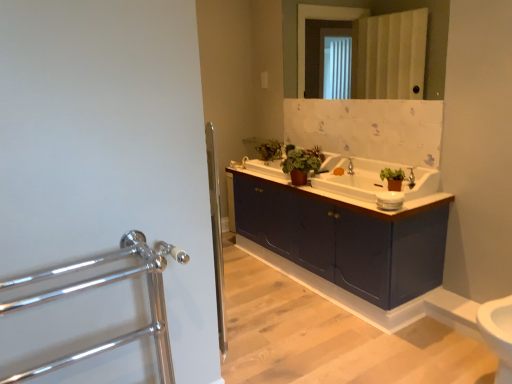
The image size is (512, 384). What do you see at coordinates (216, 234) in the screenshot?
I see `clear glass screen door at center` at bounding box center [216, 234].

Describe the element at coordinates (270, 150) in the screenshot. I see `green matte plant at upper center, which ranks as the 1th plant in left-to-right order` at that location.

Measure the distance between point (x=349, y=164) and camera.

2.93 meters.

Image resolution: width=512 pixels, height=384 pixels. I want to click on clear glass screen door at center, so click(x=216, y=234).

From a real-world perspective, which object stands above the other?

green matte plant at upper center, the second plant viewed from the front, is physically above.

Is green matte plant at upper center, arranged as the first plant when viewed from the back, positioned far away from white glossy sink at center?

That's not correct — green matte plant at upper center, arranged as the first plant when viewed from the back, is a little close to white glossy sink at center.

Where is `sink lying below the green matte plant at upper center, arranged as the first plant when viewed from the back (from the image's perspective)`? The height and width of the screenshot is (384, 512). sink lying below the green matte plant at upper center, arranged as the first plant when viewed from the back (from the image's perspective) is located at coordinates (355, 177).

From a real-world perspective, is matte blue cabinet at center positioned under matte white mirror at upper center based on gravity?

Yes.

Locate an element on the screen. Image resolution: width=512 pixels, height=384 pixels. bathroom cabinet below the matte white mirror at upper center (from the image's perspective) is located at coordinates (347, 238).

Is matte blue cabinet at center placed right next to matte white mirror at upper center?

No.

From the image's perspective, which is above, matte blue cabinet at center or matte silver faucet at center?

matte silver faucet at center is shown above in the image.

Which of these two, matte blue cabinet at center or matte silver faucet at center, is smaller?

matte silver faucet at center is smaller.

Between matte blue cabinet at center and matte silver faucet at center, which one is positioned behind?

matte silver faucet at center is further from the camera.

Considering the relative sizes of matte blue cabinet at center and matte silver faucet at center in the image provided, is matte blue cabinet at center shorter than matte silver faucet at center?

Incorrect, the height of matte blue cabinet at center does not fall short of that of matte silver faucet at center.

Considering the sizes of matte white mirror at upper center and matte silver faucet at center in the image, is matte white mirror at upper center bigger or smaller than matte silver faucet at center?

Considering their sizes, matte white mirror at upper center takes up more space than matte silver faucet at center.

Considering the sizes of objects matte white mirror at upper center and matte silver faucet at center in the image provided, who is shorter, matte white mirror at upper center or matte silver faucet at center?

matte silver faucet at center.

Is matte white mirror at upper center to the left of matte silver faucet at center from the viewer's perspective?

Correct, you'll find matte white mirror at upper center to the left of matte silver faucet at center.

Is there a large distance between matte white mirror at upper center and matte silver faucet at center?

Indeed, matte white mirror at upper center is not near matte silver faucet at center.

Can you confirm if matte white mirror at upper center is smaller than green matte plant at center, marked as the first plant in a front-to-back arrangement?

No, matte white mirror at upper center is not smaller than green matte plant at center, marked as the first plant in a front-to-back arrangement.

Consider the image. Considering the relative sizes of matte white mirror at upper center and green matte plant at center, acting as the 2th plant starting from the left, in the image provided, is matte white mirror at upper center shorter than green matte plant at center, acting as the 2th plant starting from the left,?

In fact, matte white mirror at upper center may be taller than green matte plant at center, acting as the 2th plant starting from the left.

Looking at this image, how many degrees apart are the facing directions of matte white mirror at upper center and green matte plant at center, placed as the first plant when sorted from right to left?

The facing directions of matte white mirror at upper center and green matte plant at center, placed as the first plant when sorted from right to left, are 1.13 degrees apart.

Choose the correct answer: Is matte white mirror at upper center inside green matte plant at center, the second plant viewed from the back, or outside it?

matte white mirror at upper center is not inside green matte plant at center, the second plant viewed from the back, it's outside.

Does matte blue cabinet at center turn towards clear glass screen door at center?

Yes, matte blue cabinet at center faces towards clear glass screen door at center.

Which of these two, matte blue cabinet at center or clear glass screen door at center, is wider?

matte blue cabinet at center is wider.

From the image's perspective, is matte blue cabinet at center on clear glass screen door at center?

Indeed, from the image's perspective, matte blue cabinet at center is shown above clear glass screen door at center.

Does matte blue cabinet at center lie in front of clear glass screen door at center?

That is False.

Does white glossy sink at center have a larger size compared to polished chrome towel rack at left?

Incorrect, white glossy sink at center is not larger than polished chrome towel rack at left.

Is polished chrome towel rack at left surrounded by white glossy sink at center?

Actually, polished chrome towel rack at left is outside white glossy sink at center.

From the image's perspective, is white glossy sink at center over polished chrome towel rack at left?

Yes, from the image's perspective, white glossy sink at center is on top of polished chrome towel rack at left.

Which plant is the 2nd one when counting from the back of the white glossy sink at center? Please provide its 2D coordinates.

[(270, 150)]

The height and width of the screenshot is (384, 512). What are the coordinates of `bathroom cabinet on the left of matte white mirror at upper center` in the screenshot? It's located at (347, 238).

Which object lies further to the anchor point matte silver faucet at center, green matte plant at center, the second plant viewed from the back, or matte blue cabinet at center?

matte blue cabinet at center.

Which object lies further to the anchor point matte white mirror at upper center, white glossy sink at center or green matte plant at upper center, which ranks as the 1th plant in left-to-right order?

white glossy sink at center is further to matte white mirror at upper center.

Estimate the real-world distances between objects in this image. Which object is closer to matte white mirror at upper center, clear glass screen door at center or matte blue cabinet at center?

matte blue cabinet at center is closer to matte white mirror at upper center.

Which object lies further to the anchor point matte blue cabinet at center, white glossy sink at center or matte silver faucet at center?

Among the two, matte silver faucet at center is located further to matte blue cabinet at center.

Estimate the real-world distances between objects in this image. Which object is closer to green matte plant at upper center, which ranks as the 1th plant in left-to-right order, polished chrome towel rack at left or green matte plant at center, acting as the 2th plant starting from the left?

The object closer to green matte plant at upper center, which ranks as the 1th plant in left-to-right order, is green matte plant at center, acting as the 2th plant starting from the left.

Based on their spatial positions, is green matte plant at upper center, the second plant viewed from the front, or matte white mirror at upper center closer to matte blue cabinet at center?

Based on the image, green matte plant at upper center, the second plant viewed from the front, appears to be nearer to matte blue cabinet at center.

Based on their spatial positions, is matte white mirror at upper center or green matte plant at upper center, marked as the second plant in a right-to-left arrangement, closer to polished chrome towel rack at left?

green matte plant at upper center, marked as the second plant in a right-to-left arrangement, lies closer to polished chrome towel rack at left than the other object.

Considering their positions, is matte white mirror at upper center positioned closer to green matte plant at upper center, the second plant viewed from the front, than clear glass screen door at center?

The object closer to green matte plant at upper center, the second plant viewed from the front, is matte white mirror at upper center.

The width and height of the screenshot is (512, 384). Identify the location of plant located between matte blue cabinet at center and green matte plant at upper center, arranged as the first plant when viewed from the back, in the depth direction. (316, 152).

The width and height of the screenshot is (512, 384). Find the location of `tap between matte white mirror at upper center and clear glass screen door at center vertically`. tap between matte white mirror at upper center and clear glass screen door at center vertically is located at coordinates (350, 167).

Where is `mirror located between clear glass screen door at center and green matte plant at upper center, arranged as the first plant when viewed from the back, in the depth direction`? mirror located between clear glass screen door at center and green matte plant at upper center, arranged as the first plant when viewed from the back, in the depth direction is located at coordinates (322, 19).

The image size is (512, 384). Identify the location of tap located between white glossy sink at center and green matte plant at upper center, marked as the second plant in a right-to-left arrangement, in the depth direction. (350, 167).